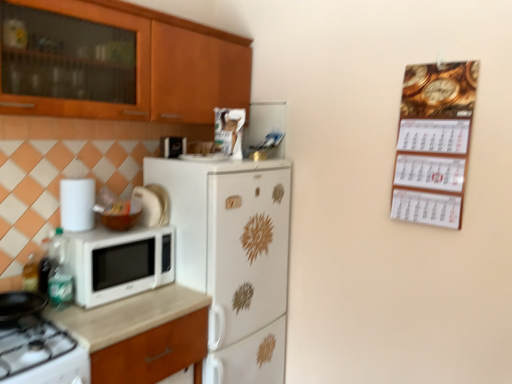
Where is `free space in front of white matte microwave at left`? The image size is (512, 384). free space in front of white matte microwave at left is located at coordinates (109, 313).